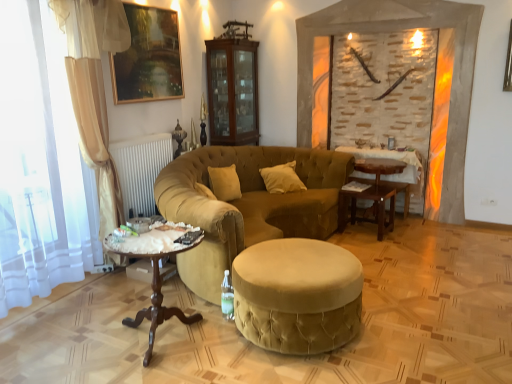
Question: Can you confirm if velvet beige stool at center is wider than wooden table at center, which is counted as the second table, starting from the front?

Choices:
 (A) yes
 (B) no

Answer: (A)

Question: Is wooden table at center, which is counted as the second table, starting from the front, located within velvet beige stool at center?

Choices:
 (A) yes
 (B) no

Answer: (B)

Question: Can you confirm if velvet beige stool at center is shorter than wooden table at center, arranged as the 1th table when viewed from the back?

Choices:
 (A) no
 (B) yes

Answer: (B)

Question: Is velvet beige stool at center closer to the viewer compared to wooden table at center, arranged as the 1th table when viewed from the back?

Choices:
 (A) yes
 (B) no

Answer: (A)

Question: Is velvet beige stool at center completely or partially outside of wooden table at center, arranged as the 1th table when viewed from the back?

Choices:
 (A) yes
 (B) no

Answer: (A)

Question: Considering the relative positions of velvet beige stool at center and wooden table at center, arranged as the 1th table when viewed from the back, in the image provided, is velvet beige stool at center to the left of wooden table at center, arranged as the 1th table when viewed from the back, from the viewer's perspective?

Choices:
 (A) no
 (B) yes

Answer: (B)

Question: From the image's perspective, does white velvet pillow at center appear higher than brown wooden cabinet at upper center?

Choices:
 (A) yes
 (B) no

Answer: (B)

Question: Is white velvet pillow at center not inside brown wooden cabinet at upper center?

Choices:
 (A) no
 (B) yes

Answer: (B)

Question: Considering the relative sizes of white velvet pillow at center and brown wooden cabinet at upper center in the image provided, is white velvet pillow at center taller than brown wooden cabinet at upper center?

Choices:
 (A) yes
 (B) no

Answer: (B)

Question: From a real-world perspective, is white velvet pillow at center beneath brown wooden cabinet at upper center?

Choices:
 (A) no
 (B) yes

Answer: (B)

Question: Does white velvet pillow at center turn towards brown wooden cabinet at upper center?

Choices:
 (A) yes
 (B) no

Answer: (B)

Question: Is white velvet pillow at center not near brown wooden cabinet at upper center?

Choices:
 (A) yes
 (B) no

Answer: (B)

Question: Is white velvet pillow at center outside stone textured fireplace at center?

Choices:
 (A) yes
 (B) no

Answer: (A)